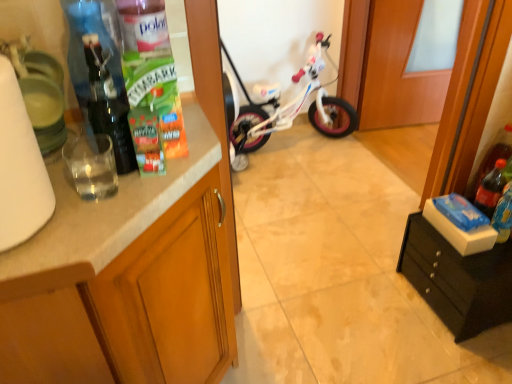
You are a GUI agent. You are given a task and a screenshot of the screen. Output one action in this format:
    pyautogui.click(x=<x>, y=<y>)
    Task: Click on the vacant area in front of white glossy bicycle at center
    
    Given the screenshot: What is the action you would take?
    pyautogui.click(x=313, y=195)